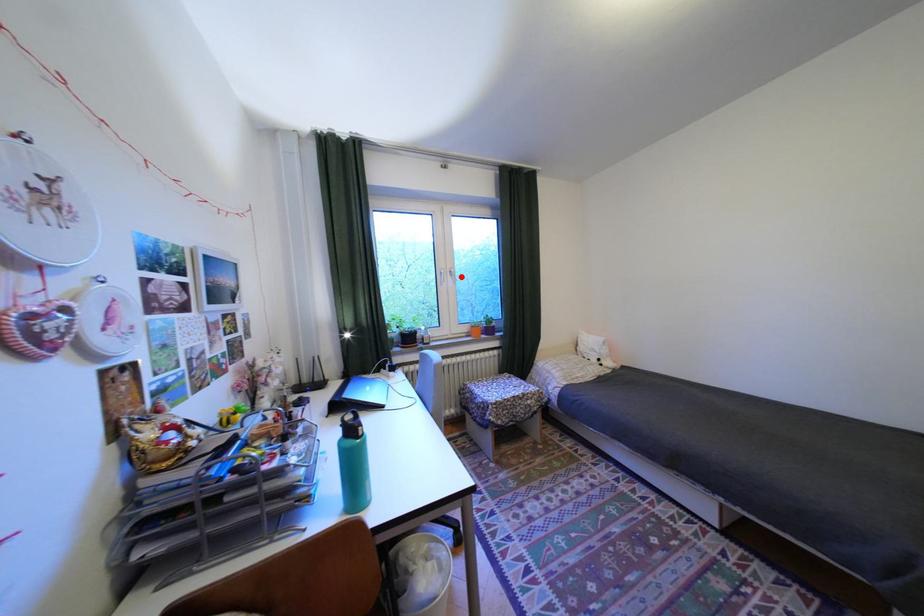
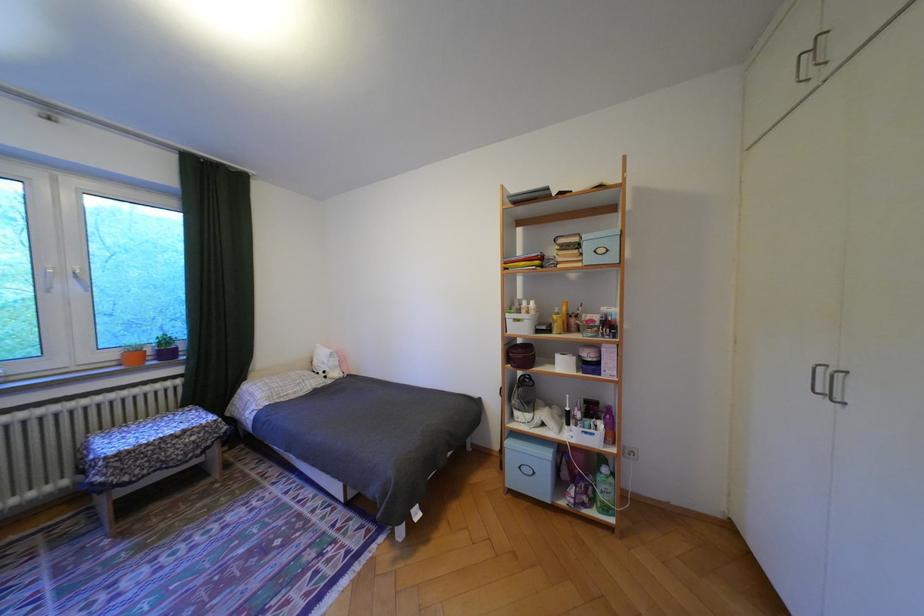
Where in the second image is the point corresponding to the highlighted location from the first image?

(84, 280)